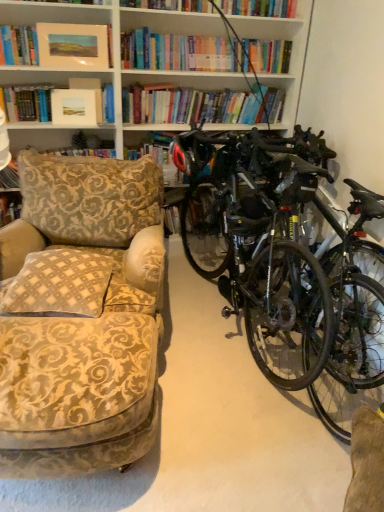
Describe the element at coordinates (76, 106) in the screenshot. I see `matte white picture frame at upper center` at that location.

In order to face shiny black bicycle at right, should I rotate leftwards or rightwards?

A 7.675 degree turn to the right will do.

Find the location of a particular element. This screenshot has width=384, height=512. matte black helmet at center is located at coordinates (193, 153).

Is beige checkered pillow at left at the back of matte black helmet at center?

No, matte black helmet at center is not facing away from beige checkered pillow at left.

Is matte black helmet at center positioned beyond the bounds of beige checkered pillow at left?

Yes, matte black helmet at center is not within beige checkered pillow at left.

I want to click on pillow in front of the matte black helmet at center, so click(x=59, y=284).

Who is shorter, beige checkered pillow at left or matte white picture frame at upper center?

beige checkered pillow at left is shorter.

How different are the orientations of beige checkered pillow at left and matte white picture frame at upper center in degrees?

They differ by 12.3 degrees in their facing directions.

Find the location of a particular element. picture frame above the beige checkered pillow at left (from a real-world perspective) is located at coordinates (76, 106).

Would you say beige checkered pillow at left is inside or outside matte white picture frame at upper center?

The correct answer is: outside.

In terms of size, does matte white picture frame at upper center appear bigger or smaller than matte black helmet at center?

In the image, matte white picture frame at upper center appears to be smaller than matte black helmet at center.

Locate an element on the screen. Image resolution: width=384 pixels, height=512 pixels. picture frame behind the matte black helmet at center is located at coordinates (76, 106).

Could you tell me if matte white picture frame at upper center is turned towards matte black helmet at center?

No.

Choose the correct answer: Is matte white picture frame at upper center inside matte black helmet at center or outside it?

matte white picture frame at upper center is spatially situated outside matte black helmet at center.

Considering the relative positions of beige checkered pillow at left and matte oil painting at upper left, the 2th book positioned from the back, in the image provided, is beige checkered pillow at left to the right of matte oil painting at upper left, the 2th book positioned from the back, from the viewer's perspective?

Yes.

Identify the location of pillow on the right side of matte oil painting at upper left, the 2th book positioned from the back. (59, 284).

Could you measure the distance between beige checkered pillow at left and matte oil painting at upper left, arranged as the 1th book when viewed from the top?

The distance of beige checkered pillow at left from matte oil painting at upper left, arranged as the 1th book when viewed from the top, is 4.59 feet.

From the picture: Relative to matte oil painting at upper left, placed as the 1th book when sorted from front to back, is beige checkered pillow at left in front or behind?

Visually, beige checkered pillow at left is located in front of matte oil painting at upper left, placed as the 1th book when sorted from front to back.

Is point (75, 59) farther from camera compared to point (56, 308)?

Yes.

Is beige checkered pillow at left located within matte oil painting at upper left, positioned as the 2th book in bottom-to-top order?

Definitely not — beige checkered pillow at left is not inside matte oil painting at upper left, positioned as the 2th book in bottom-to-top order.

Considering the sizes of objects matte oil painting at upper left, the 2th book positioned from the back, and beige checkered pillow at left in the image provided, who is smaller, matte oil painting at upper left, the 2th book positioned from the back, or beige checkered pillow at left?

matte oil painting at upper left, the 2th book positioned from the back.

Is matte black helmet at center inside the boundaries of matte oil painting at upper left, arranged as the 1th book when viewed from the top, or outside?

matte black helmet at center exists outside the volume of matte oil painting at upper left, arranged as the 1th book when viewed from the top.

From a real-world perspective, is matte black helmet at center under matte oil painting at upper left, arranged as the 1th book when viewed from the top?

Correct, in the physical world, matte black helmet at center is lower than matte oil painting at upper left, arranged as the 1th book when viewed from the top.

Considering the relative positions of matte black helmet at center and matte oil painting at upper left, arranged as the 1th book when viewed from the top, in the image provided, is matte black helmet at center to the left or to the right of matte oil painting at upper left, arranged as the 1th book when viewed from the top,?

From the image, it's evident that matte black helmet at center is to the right of matte oil painting at upper left, arranged as the 1th book when viewed from the top.

Is matte black helmet at center bigger or smaller than matte oil painting at upper left, positioned as the 2th book in bottom-to-top order?

Clearly, matte black helmet at center is larger in size than matte oil painting at upper left, positioned as the 2th book in bottom-to-top order.

Can you see patterned fabric cushion at left, the 2th book when ordered from front to back, touching beige checkered pillow at left?

No, patterned fabric cushion at left, the 2th book when ordered from front to back, is not in contact with beige checkered pillow at left.

From the image's perspective, between patterned fabric cushion at left, which ranks as the first book in back-to-front order, and beige checkered pillow at left, which one is located above?

patterned fabric cushion at left, which ranks as the first book in back-to-front order.

Which of these two, patterned fabric cushion at left, which appears as the first book when ordered from the bottom, or beige checkered pillow at left, is bigger?

With larger size is patterned fabric cushion at left, which appears as the first book when ordered from the bottom.

Is patterned fabric cushion at left, which appears as the first book when ordered from the bottom, inside or outside of beige checkered pillow at left?

patterned fabric cushion at left, which appears as the first book when ordered from the bottom, is located beyond the bounds of beige checkered pillow at left.

Identify the location of helmet above the beige checkered pillow at left (from the image's perspective). The image size is (384, 512). (193, 153).

Locate an element on the screen. picture frame above the beige checkered pillow at left (from a real-world perspective) is located at coordinates (76, 106).

Estimate the real-world distances between objects in this image. Which object is closer to patterned fabric cushion at left, which appears as the first book when ordered from the bottom, beige checkered pillow at left or matte white picture frame at upper center?

matte white picture frame at upper center.

Estimate the real-world distances between objects in this image. Which object is closer to matte white picture frame at upper center, beige checkered pillow at left or matte oil painting at upper left, positioned as the 2th book in bottom-to-top order?

matte oil painting at upper left, positioned as the 2th book in bottom-to-top order, is positioned closer to the anchor matte white picture frame at upper center.

From the image, which object appears to be nearer to matte white picture frame at upper center, shiny black bicycle at right or matte oil painting at upper left, the 2th book positioned from the back?

Among the two, matte oil painting at upper left, the 2th book positioned from the back, is located nearer to matte white picture frame at upper center.

Looking at the image, which one is located further to shiny black bicycle at right, beige checkered pillow at left or matte white picture frame at upper center?

matte white picture frame at upper center is further to shiny black bicycle at right.

Considering their positions, is beige checkered pillow at left positioned closer to matte oil painting at upper left, arranged as the 1th book when viewed from the top, than patterned fabric cushion at left, which appears as the first book when ordered from the bottom?

Based on the image, patterned fabric cushion at left, which appears as the first book when ordered from the bottom, appears to be nearer to matte oil painting at upper left, arranged as the 1th book when viewed from the top.

From the image, which object appears to be farther from shiny black bicycle at right, matte black helmet at center or matte white picture frame at upper center?

The object further to shiny black bicycle at right is matte white picture frame at upper center.

Estimate the real-world distances between objects in this image. Which object is further from matte black helmet at center, matte oil painting at upper left, positioned as the 2th book in bottom-to-top order, or shiny black bicycle at right?

Based on the image, matte oil painting at upper left, positioned as the 2th book in bottom-to-top order, appears to be further to matte black helmet at center.

From the image, which object appears to be nearer to shiny black bicycle at right, matte black helmet at center or matte oil painting at upper left, arranged as the 1th book when viewed from the top?

matte black helmet at center.

What are the coordinates of `helmet located between shiny black bicycle at right and matte white picture frame at upper center in the depth direction` in the screenshot? It's located at (193, 153).

Where is `helmet between shiny black bicycle at right and matte oil painting at upper left, arranged as the 1th book when viewed from the top, in the front-back direction`? This screenshot has height=512, width=384. helmet between shiny black bicycle at right and matte oil painting at upper left, arranged as the 1th book when viewed from the top, in the front-back direction is located at coordinates (193, 153).

What are the coordinates of `book between shiny black bicycle at right and patterned fabric cushion at left, the 2th book from the top, in the front-back direction` in the screenshot? It's located at (79, 44).

I want to click on helmet located between beige checkered pillow at left and patterned fabric cushion at left, the 2th book when ordered from front to back, in the depth direction, so click(x=193, y=153).